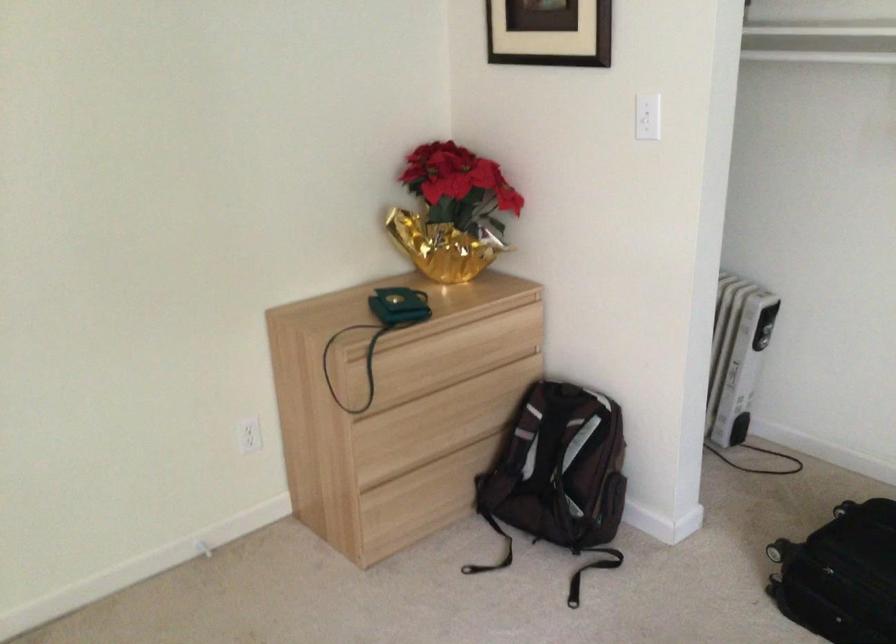
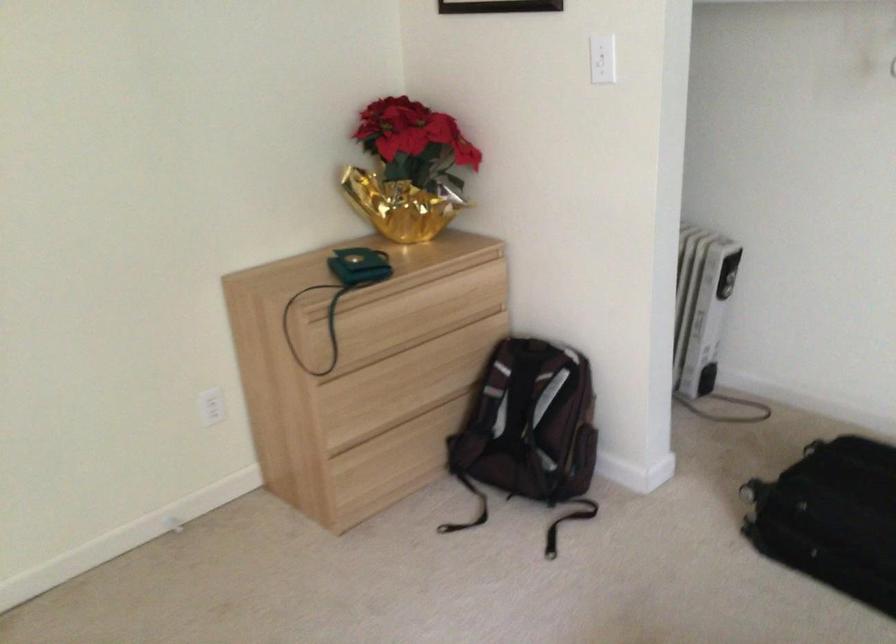
Locate, in the second image, the point that corresponds to pixel 647 114 in the first image.

(601, 59)